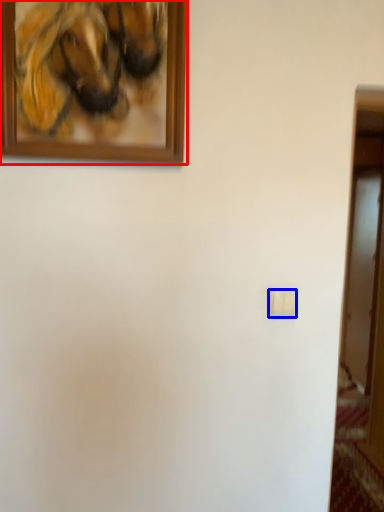
Question: Which object appears farthest to the camera in this image, picture frame (highlighted by a red box) or light switch (highlighted by a blue box)?

Choices:
 (A) picture frame
 (B) light switch

Answer: (B)